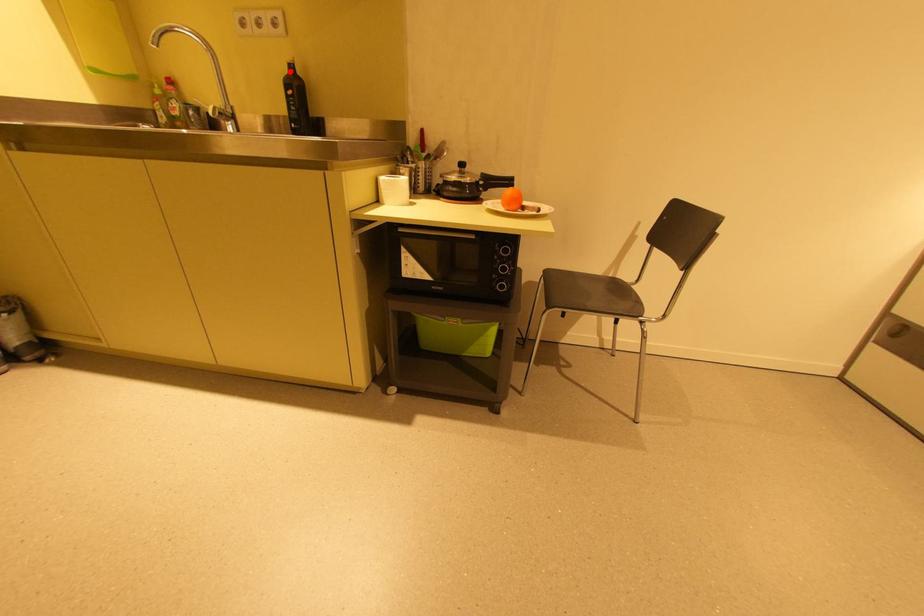
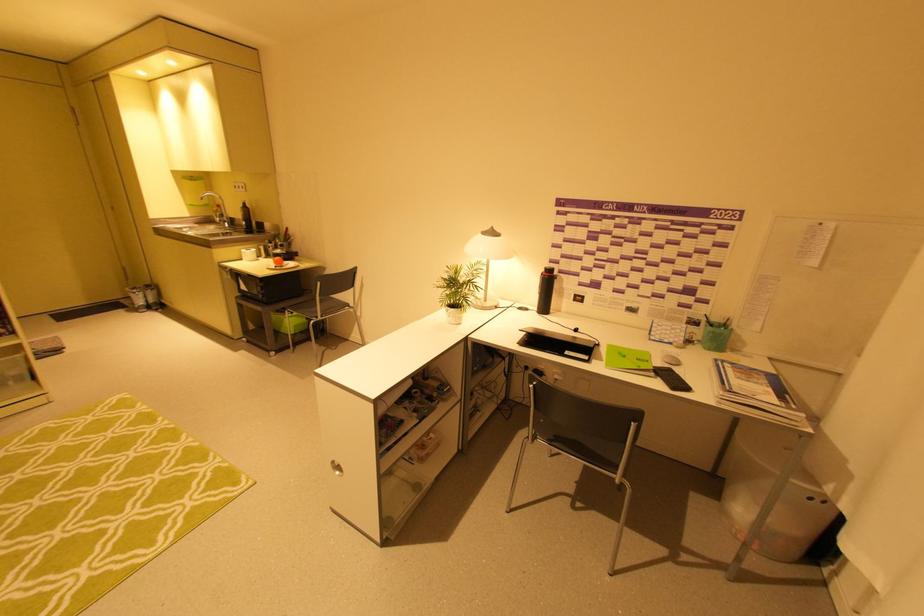
Question: I am providing you with two images of the same scene from different viewpoints. Image1 has a red point marked. In image2, the corresponding 3D location appears at what relative position? Reply with the corresponding letter.

Choices:
 (A) Closer
 (B) Farther

Answer: (A)